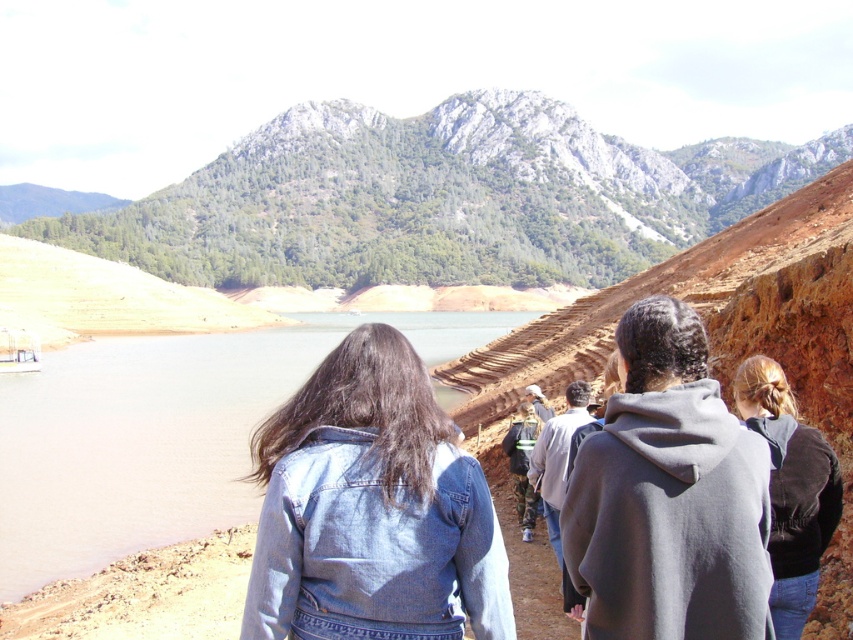
You are a photographer positioned at the back of the group, aiming to capture a photo of both the gray fleece jacket at center and the black velvet jacket at right. Which jacket should you focus on first to ensure both are in the frame?

You should focus on the gray fleece jacket at center first because it is in front of the black velvet jacket at right, so adjusting the camera to include the closer jacket ensures the one behind is also captured.

You are planning to cross the path to reach the mountain trail on the other side. Considering the brown matte water at lower left and the denim jacket at lower center, which one is wider?

The brown matte water at lower left is wider than the denim jacket at lower center.